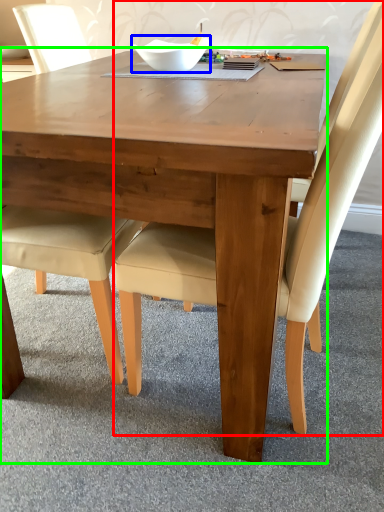
Question: Estimate the real-world distances between objects in this image. Which object is closer to chair (highlighted by a red box), bowl (highlighted by a blue box) or coffee table (highlighted by a green box)?

Choices:
 (A) bowl
 (B) coffee table

Answer: (B)